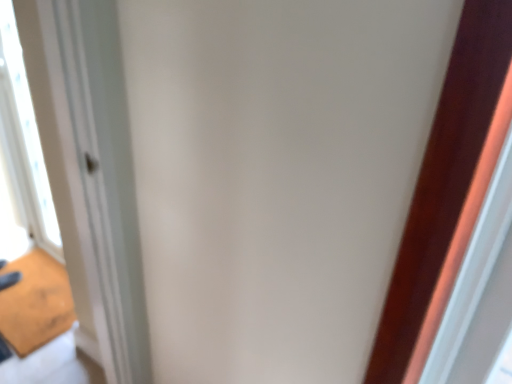
This screenshot has width=512, height=384. Identify the location of white glossy door at left. (100, 174).

In order to face white glossy door at left, should I rotate leftwards or rightwards?

It's best to rotate left around 27.916 degrees.

This screenshot has width=512, height=384. Describe the element at coordinates (100, 174) in the screenshot. I see `white glossy door at left` at that location.

I want to click on white glossy door at left, so click(x=100, y=174).